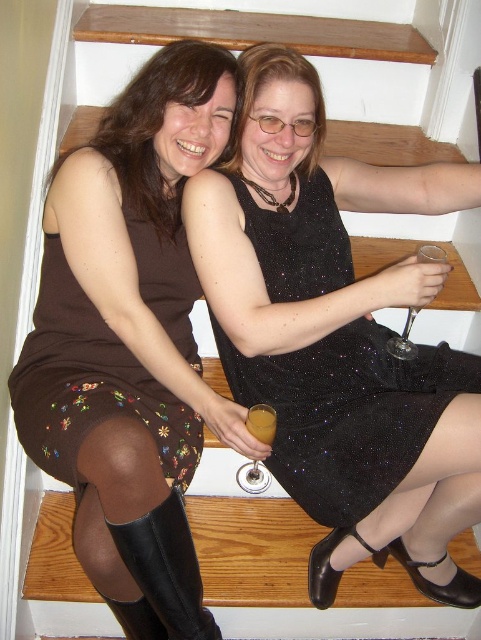
You are standing at the bottom of the staircase and want to place a new decorative item exactly at the point marked as point (262, 422). What object is currently occupying that location?

The amber glass at lower center is currently occupying the point (262, 422).

You are a photographer taking a picture of the matte brown dress at upper left and the amber glass at lower center. Which object will appear closer to the camera in the photo?

The matte brown dress at upper left is in front of the amber glass at lower center, so it will appear closer to the camera in the photo.

You are a photographer setting up a shoot on a staircase. You have two props to place in the scene described. The first prop is a small decorative item that must fit into the space where the amber glass at lower center is currently located. The second prop is a large decorative item that needs to be placed near the matte brown dress at upper left. Based on the size comparison between these two objects, which prop should go where?

The matte brown dress at upper left is larger in size than the amber glass at lower center. Therefore, the large decorative item should be placed near the matte brown dress at upper left, and the small decorative item should be placed where the amber glass at lower center is located.